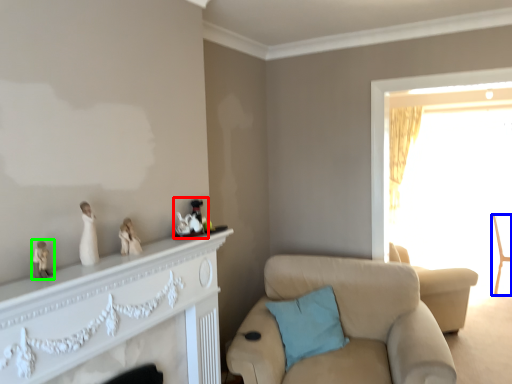
Question: Which object is positioned closest to toy (highlighted by a red box)? Select from chair (highlighted by a blue box) and toy (highlighted by a green box).

Choices:
 (A) chair
 (B) toy

Answer: (B)